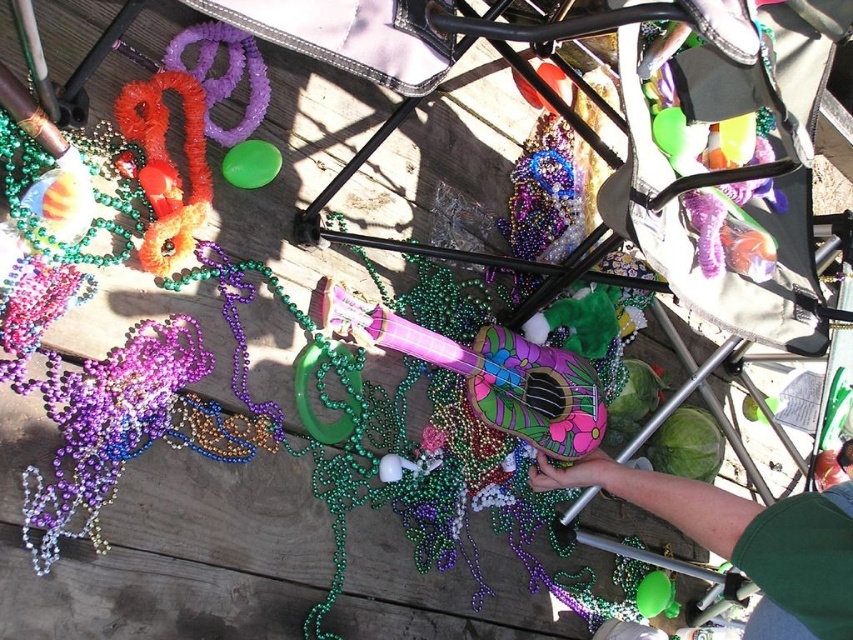
Question: Does green fabric hand at lower right appear under painted wood ukulele at center?

Choices:
 (A) yes
 (B) no

Answer: (A)

Question: Which object is the closest to the green fabric hand at lower right?

Choices:
 (A) painted wood ukulele at center
 (B) orange fuzzy pipe at upper left

Answer: (A)

Question: Which point is farther to the camera?

Choices:
 (A) green fabric hand at lower right
 (B) orange fuzzy pipe at upper left

Answer: (B)

Question: Can you confirm if painted wood ukulele at center is thinner than orange fuzzy pipe at upper left?

Choices:
 (A) yes
 (B) no

Answer: (B)

Question: Can you confirm if green fabric hand at lower right is smaller than painted wood ukulele at center?

Choices:
 (A) no
 (B) yes

Answer: (A)

Question: Which of these objects is positioned farthest from the orange fuzzy pipe at upper left?

Choices:
 (A) painted wood ukulele at center
 (B) green fabric hand at lower right

Answer: (B)